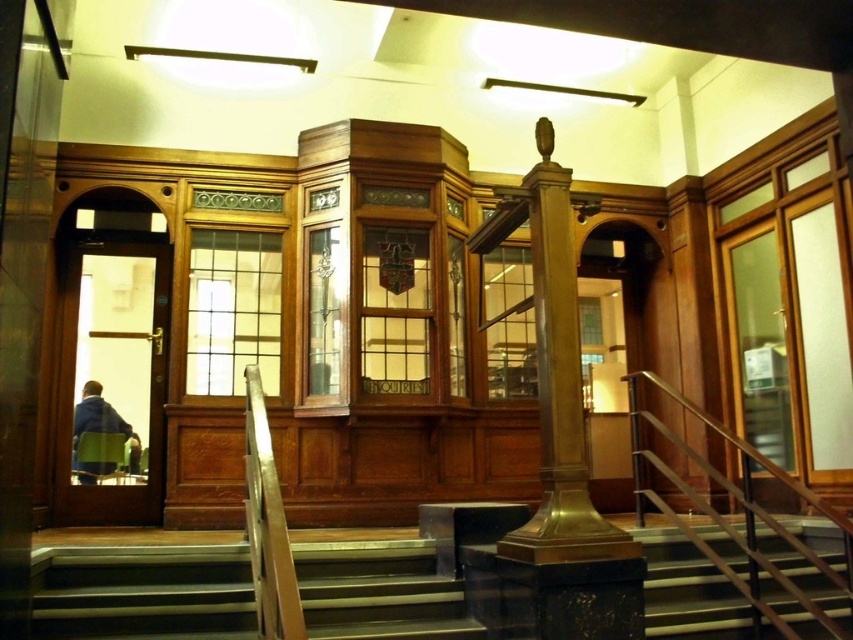
You are a delivery person holding a package that is 2 meters long. You are standing at the blue fabric jacket at left and need to move the package to the wooden stairs at center. Can you move the package horizontally without tilting it? Please explain your reasoning.

The wooden stairs at center and blue fabric jacket at left are 1.89 meters apart. Since the package is 2 meters long, which is longer than the distance between them, you cannot move the package horizontally without tilting it.

From the picture: You are an interior designer planning to place a large decorative sculpture in this space. You have two options for placement locations near the polished marble steps at center and the polished metal railing at right. Which location would allow the sculpture to occupy more horizontal space?

The polished marble steps at center might be wider than polished metal railing at right, so placing the sculpture near the polished marble steps at center would allow it to occupy more horizontal space.

You are standing at the bottom of the wooden stairs at center and want to pick up the blue fabric jacket at left. Which direction should you move to reach the jacket?

The wooden stairs at center is below the blue fabric jacket at left, so you should move upwards towards the blue fabric jacket at left.